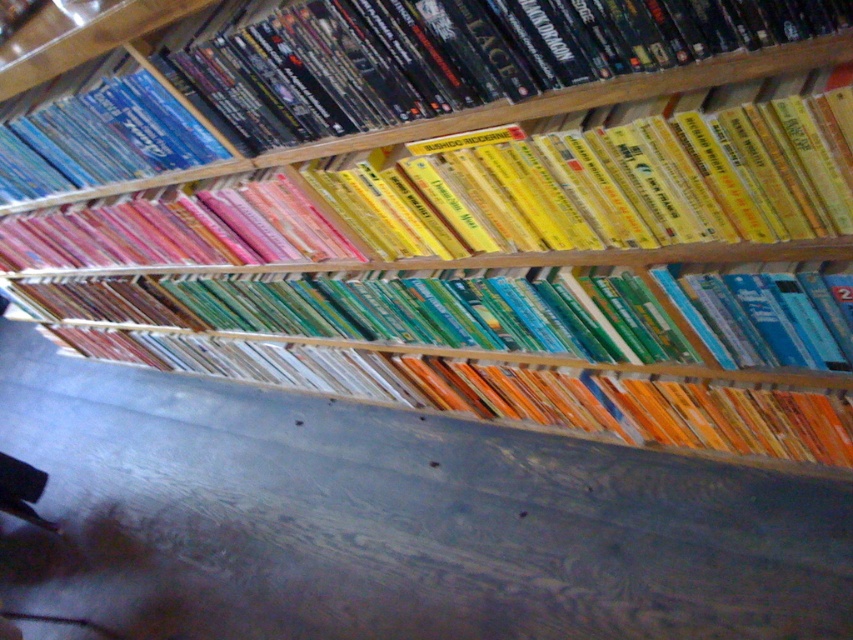
You are organizing a bookshelf and notice the matte black book at upper center and the yellow matte book at upper center. Which book is placed above the other?

The matte black book at upper center is positioned over the yellow matte book at upper center, so it is placed above the yellow one.

You are organizing books on a shelf and need to stack them vertically. Given that you have the matte black book at upper center and the yellow matte book at upper center, which one should you place at the bottom to ensure stability?

The matte black book at upper center should be placed at the bottom since it has a greater height than the yellow matte book at upper center, providing a more stable base.

You are organizing a library and need to place both the matte black book at upper center and the blue glossy dvd at upper left on a shelf. Given their sizes, which one should you place first to ensure they fit properly?

The matte black book at upper center has a smaller size compared to the blue glossy dvd at upper left. Therefore, you should place the blue glossy dvd at upper left first, as it is larger and requires more space, ensuring both items fit properly on the shelf.